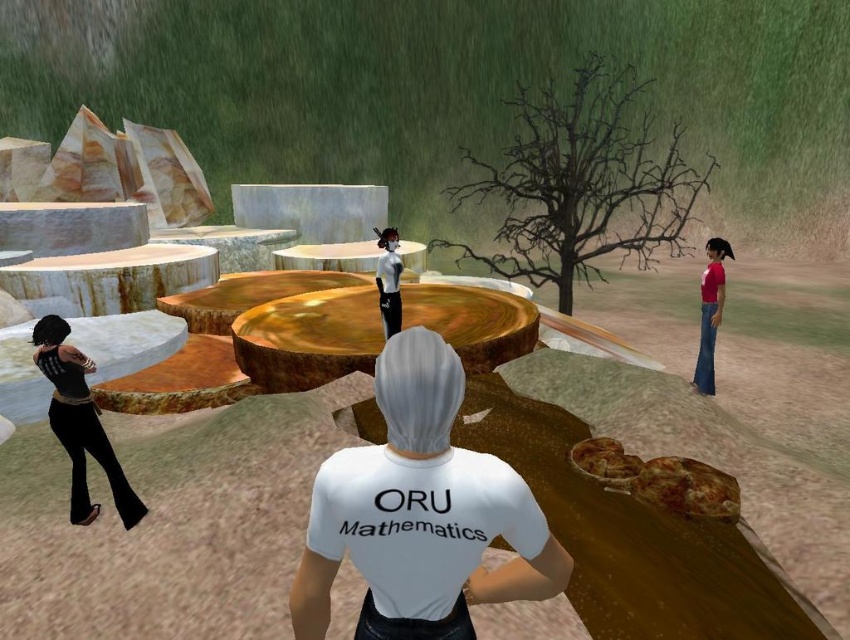
Does brown leafless tree at center have a lesser width compared to velvet black pants at left?

Incorrect, brown leafless tree at center's width is not less than velvet black pants at left's.

Between point (547, 109) and point (61, 348), which one is positioned behind?

The point (547, 109) is more distant.

Who is more forward, (x=559, y=152) or (x=51, y=410)?

Positioned in front is point (x=51, y=410).

Image resolution: width=850 pixels, height=640 pixels. I want to click on brown leafless tree at center, so click(x=582, y=180).

Does white matte shirt at center appear on the right side of velvet black pants at left?

Correct, you'll find white matte shirt at center to the right of velvet black pants at left.

Find the location of a particular element. The height and width of the screenshot is (640, 850). white matte shirt at center is located at coordinates (420, 513).

This screenshot has height=640, width=850. Identify the location of white matte shirt at center. (420, 513).

Is point (313, 627) behind point (397, 314)?

That is False.

You are a GUI agent. You are given a task and a screenshot of the screen. Output one action in this format:
    pyautogui.click(x=<x>, y=<y>)
    Task: Click on the white matte shirt at center
    The width and height of the screenshot is (850, 640).
    Given the screenshot: What is the action you would take?
    pyautogui.click(x=420, y=513)

Image resolution: width=850 pixels, height=640 pixels. I want to click on white matte shirt at center, so click(x=420, y=513).